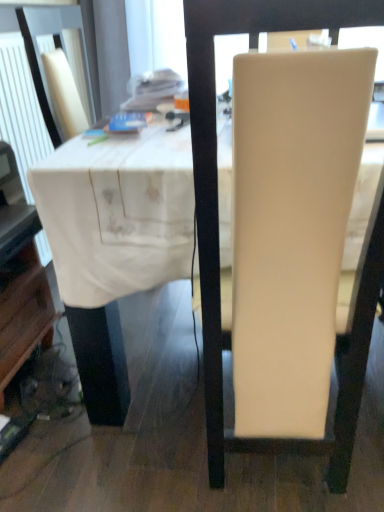
Question: From a real-world perspective, is beige leather chair at center located higher than white fabric table at center?

Choices:
 (A) no
 (B) yes

Answer: (B)

Question: Is beige leather chair at center located outside white fabric table at center?

Choices:
 (A) no
 (B) yes

Answer: (A)

Question: Is beige leather chair at center positioned with its back to white fabric table at center?

Choices:
 (A) no
 (B) yes

Answer: (B)

Question: From the image's perspective, is beige leather chair at center under white fabric table at center?

Choices:
 (A) no
 (B) yes

Answer: (B)

Question: Is beige leather chair at center far away from white fabric table at center?

Choices:
 (A) no
 (B) yes

Answer: (A)

Question: Is beige leather chair at center to the right of white fabric table at center from the viewer's perspective?

Choices:
 (A) no
 (B) yes

Answer: (A)

Question: Is white fabric table at center next to beige leather chair at center?

Choices:
 (A) yes
 (B) no

Answer: (B)

Question: From the image's perspective, is white fabric table at center beneath beige leather chair at center?

Choices:
 (A) yes
 (B) no

Answer: (B)

Question: Can we say white fabric table at center lies outside beige leather chair at center?

Choices:
 (A) yes
 (B) no

Answer: (A)

Question: Is white fabric table at center positioned with its back to beige leather chair at center?

Choices:
 (A) no
 (B) yes

Answer: (A)

Question: Is white fabric table at center taller than beige leather chair at center?

Choices:
 (A) no
 (B) yes

Answer: (A)

Question: From a real-world perspective, is white fabric table at center over beige leather chair at center?

Choices:
 (A) yes
 (B) no

Answer: (B)

Question: Considering the positions of beige leather chair at center and white fabric table at center in the image, is beige leather chair at center taller or shorter than white fabric table at center?

Choices:
 (A) short
 (B) tall

Answer: (B)